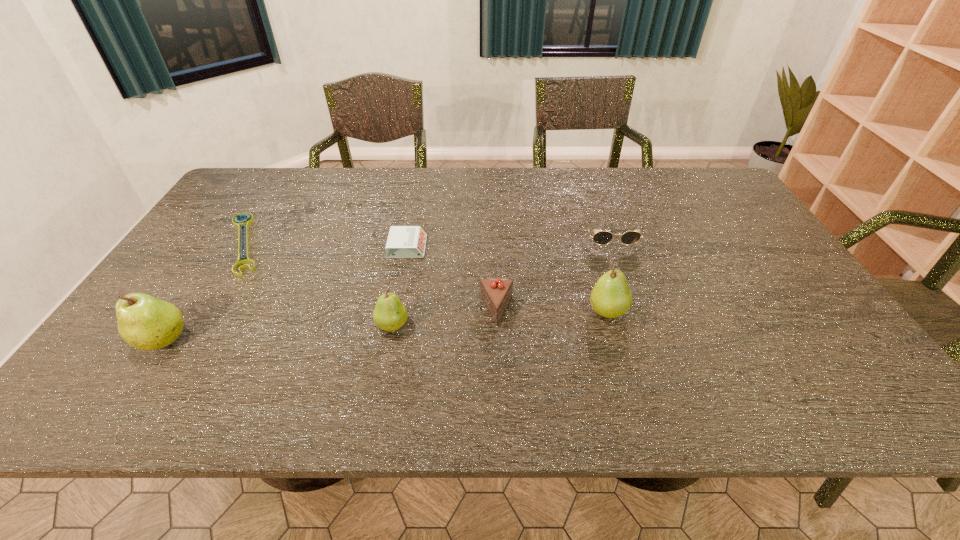
At what (x,y) coordinates should I click in order to perform the action: click on free point at the far edge. Please return your answer as a coordinate pair (x, y). This screenshot has width=960, height=540. Looking at the image, I should click on (504, 192).

In the image, there is a desktop. Where is `vacant space at the near edge`? The height and width of the screenshot is (540, 960). vacant space at the near edge is located at coordinates (661, 363).

Image resolution: width=960 pixels, height=540 pixels. In the image, there is a desktop. In order to click on vacant space at the left edge in this screenshot , I will do `click(258, 225)`.

The width and height of the screenshot is (960, 540). I want to click on vacant area at the right edge, so click(755, 240).

The image size is (960, 540). In order to click on free point at the far left corner in this screenshot , I will do `click(270, 202)`.

Locate an element on the screen. The height and width of the screenshot is (540, 960). free space between the second pear from right to left and the alarm clock is located at coordinates (400, 286).

Find the location of a particular element. The image size is (960, 540). unoccupied area between the wrench and the alarm clock is located at coordinates (325, 245).

You are a GUI agent. You are given a task and a screenshot of the screen. Output one action in this format:
    pyautogui.click(x=<x>, y=<y>)
    Task: Click on the empty location between the tallest pear and the shortest object
    The height and width of the screenshot is (540, 960).
    Given the screenshot: What is the action you would take?
    pyautogui.click(x=204, y=292)

Locate an element on the screen. free spot between the third tallest object and the alarm clock is located at coordinates (400, 286).

The image size is (960, 540). I want to click on empty space between the chocolate cake and the sunglasses, so click(x=553, y=273).